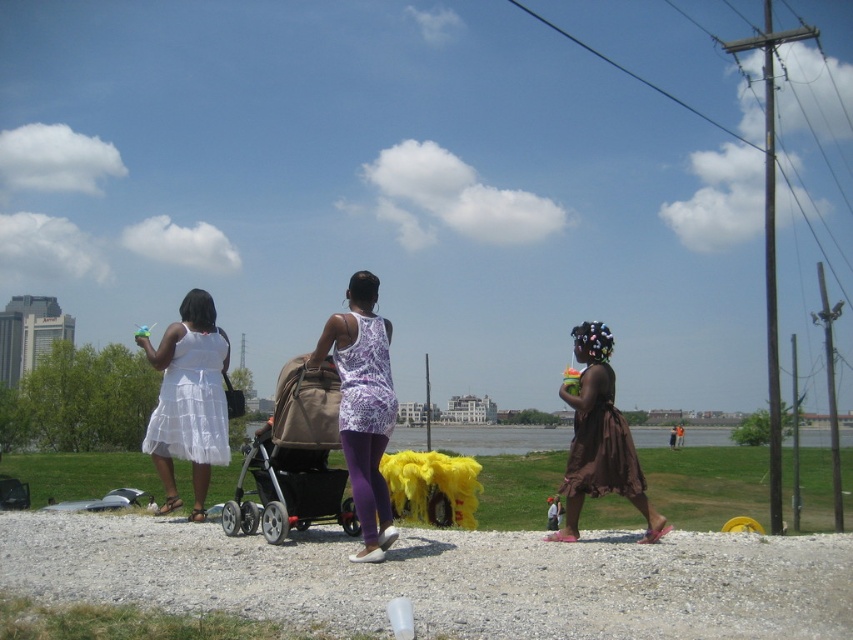
This screenshot has height=640, width=853. In order to click on brown satin dress at right in this screenshot , I will do `click(601, 440)`.

Who is taller, brown satin dress at right or white satin dress at left?

Standing taller between the two is brown satin dress at right.

Does point (581, 506) come behind point (221, 390)?

No, (581, 506) is in front of (221, 390).

Image resolution: width=853 pixels, height=640 pixels. Identify the location of brown satin dress at right. click(601, 440).

Between brown fabric stroller at center and white satin dress at left, which one has less height?

With less height is white satin dress at left.

Can you confirm if brown fabric stroller at center is wider than white satin dress at left?

Yes, brown fabric stroller at center is wider than white satin dress at left.

Between point (306, 472) and point (175, 342), which one is positioned behind?

The point (175, 342) is behind.

At what (x,y) coordinates should I click in order to perform the action: click on brown fabric stroller at center. Please return your answer as a coordinate pair (x, y). The image size is (853, 640). Looking at the image, I should click on click(x=294, y=460).

Who is positioned more to the right, white satin dress at left or brown satin dress at lower right?

From the viewer's perspective, brown satin dress at lower right appears more on the right side.

Does point (189, 385) come closer to viewer compared to point (606, 480)?

No, it is behind (606, 480).

Describe the element at coordinates (190, 403) in the screenshot. This screenshot has width=853, height=640. I see `white satin dress at left` at that location.

You are a GUI agent. You are given a task and a screenshot of the screen. Output one action in this format:
    pyautogui.click(x=<x>, y=<y>)
    Task: Click on the white satin dress at left
    
    Given the screenshot: What is the action you would take?
    pyautogui.click(x=190, y=403)